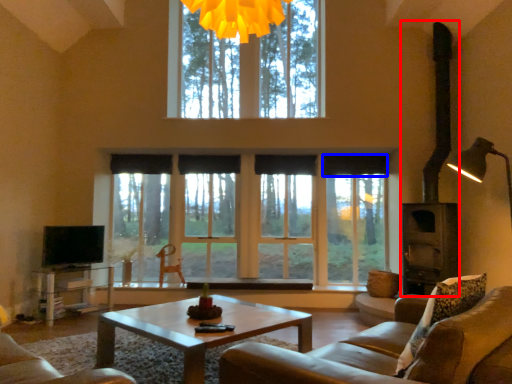
Question: Which object appears farthest to the camera in this image, fireplace (highlighted by a red box) or curtain (highlighted by a blue box)?

Choices:
 (A) fireplace
 (B) curtain

Answer: (B)